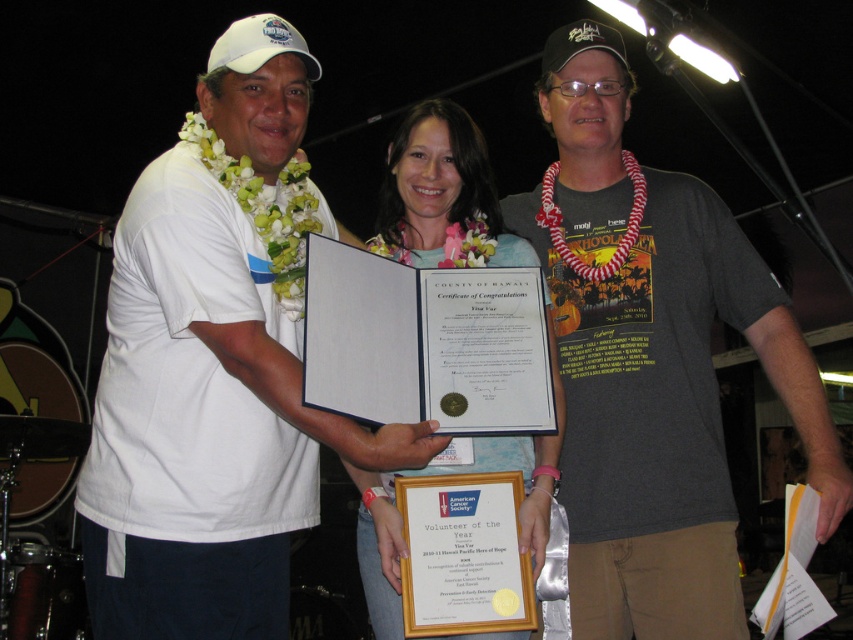
You are a photographer at the event and want to ensure all three individuals are visible in the photo. The camera you are using has a limited field of view. Given that the gray cotton t shirt at center is at point (x=653, y=362), can you confirm if the person on the left and the individual in the middle are within the frame?

The gray cotton t shirt at center is located at point (x=653, y=362), which is within the camera frame. Since the person on the left and the individual in the middle are part of the same group, they should also be within the frame.